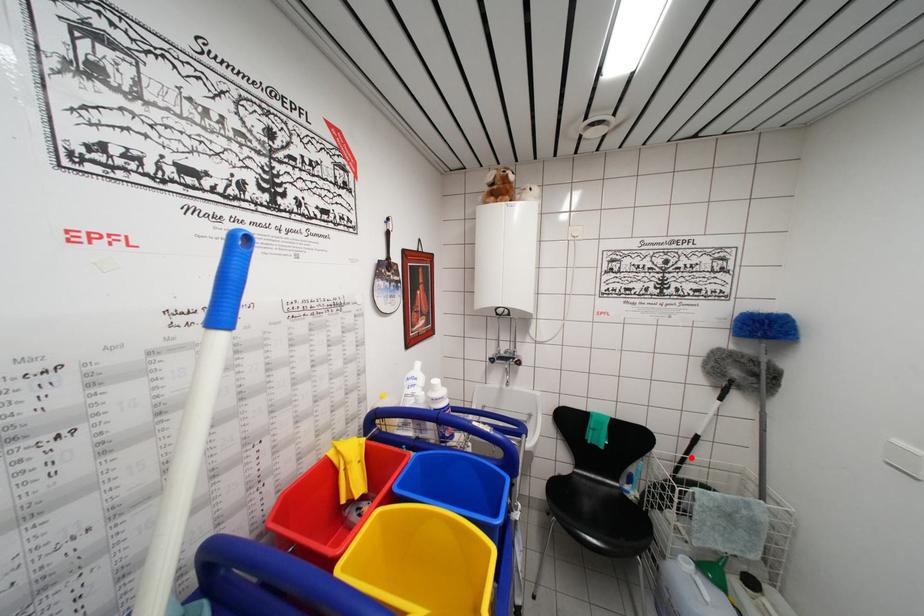
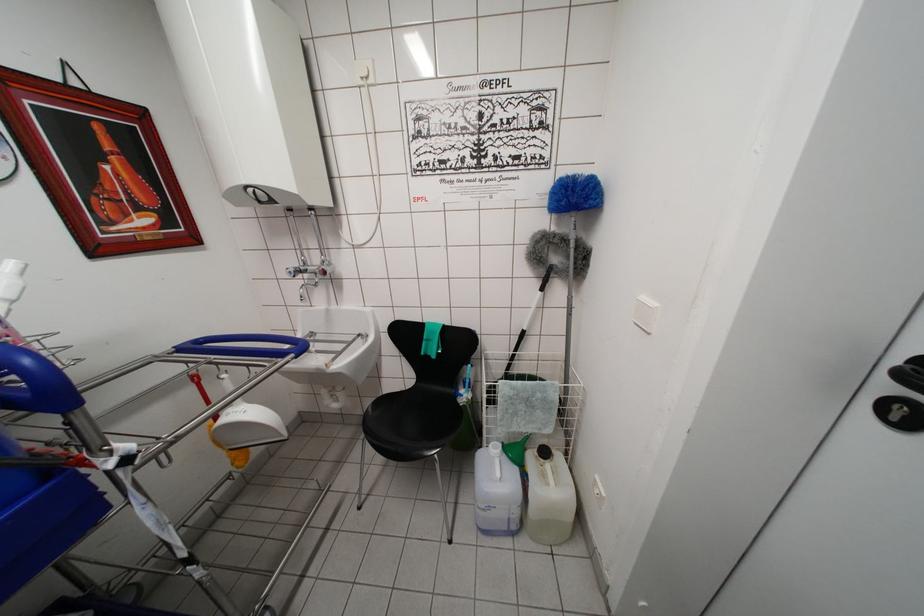
Question: A red point is marked in image1. In image2, is the corresponding 3D point closer to the camera or farther? Reply with the corresponding letter.

Choices:
 (A) The corresponding 3D point is closer.
 (B) The corresponding 3D point is farther.

Answer: (B)